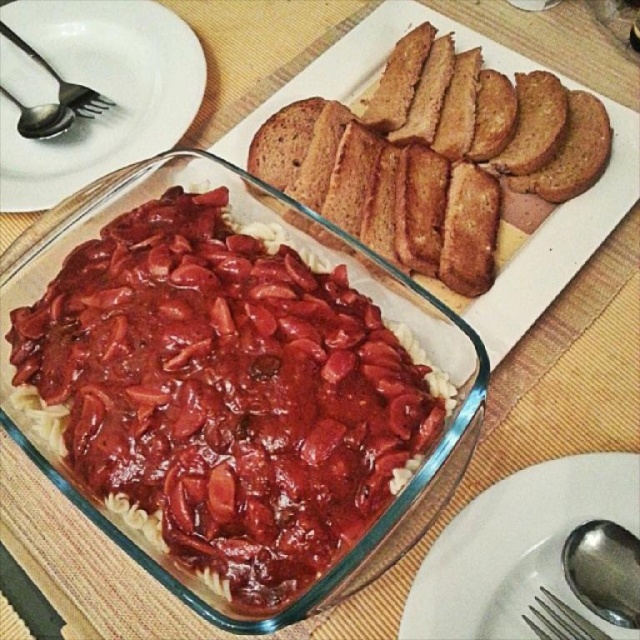
You are arranging a dinner table and need to place a napkin between the white ceramic plate at upper left and the satin silver spoon at lower right. Which object should the napkin be closer to if you want it to be centered between them?

The white ceramic plate at upper left is wider than the satin silver spoon at lower right. To center the napkin between them, it should be closer to the satin silver spoon at lower right since the plate is wider and occupies more space.

Looking at this image, you are a chef holding a 30 cm long spatula. You want to reach the satin silver spoon at lower right from your current position. Can you reach it with your spatula?

The satin silver spoon at lower right is 35.57 centimeters from viewer. Since the spatula is 30 cm long, you cannot reach it.

From the picture: You are setting the table for a dinner party and need to choose between the brushed metal fork at upper left and the silver metallic spoon at upper left. Which utensil is bigger?

The brushed metal fork at upper left is larger in size than the silver metallic spoon at upper left, so the fork is bigger.